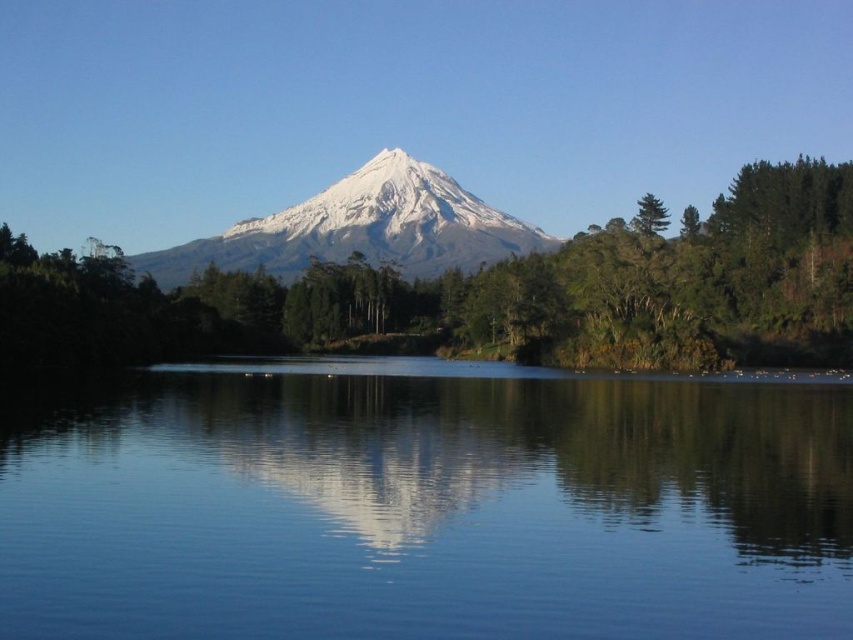
Which is behind, point (763, 262) or point (285, 227)?

The point (285, 227) is more distant.

Who is higher up, green leafy trees at center or white snow-covered mountain at center?

white snow-covered mountain at center is above.

I want to click on green leafy trees at center, so click(x=486, y=296).

Can you confirm if smooth blue water at center is taller than green matte tree at upper right?

No, smooth blue water at center is not taller than green matte tree at upper right.

Does point (370, 593) come in front of point (657, 227)?

Yes, it is.

Which is in front, point (635, 579) or point (642, 218)?

Point (635, 579) is more forward.

Identify the location of smooth blue water at center. click(432, 508).

Which is above, white snow-covered mountain at center or green matte tree at upper right?

green matte tree at upper right is above.

Describe the element at coordinates (361, 228) in the screenshot. This screenshot has width=853, height=640. I see `white snow-covered mountain at center` at that location.

This screenshot has width=853, height=640. Identify the location of white snow-covered mountain at center. (361, 228).